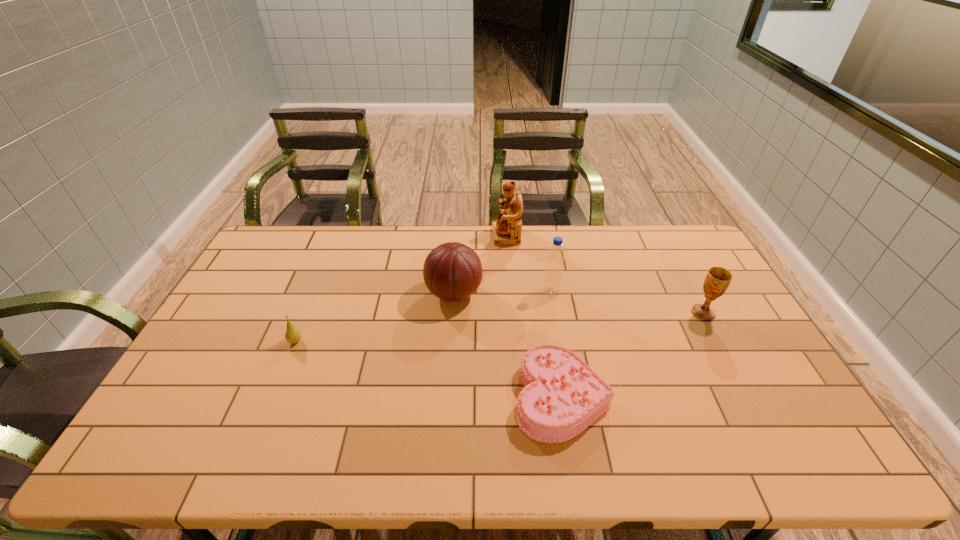
Locate an element on the screen. vacant space located 0.230m on the front-facing side of the figurine is located at coordinates (433, 236).

Image resolution: width=960 pixels, height=540 pixels. What are the coordinates of `free spot located on the front-facing side of the figurine` in the screenshot? It's located at (435, 236).

This screenshot has height=540, width=960. In order to click on vacant point located on the front of the water bottle in this screenshot , I will do `click(562, 354)`.

You are a GUI agent. You are given a task and a screenshot of the screen. Output one action in this format:
    pyautogui.click(x=<x>, y=<y>)
    Task: Click on the vacant space situated on the front of the basketball
    This screenshot has width=960, height=540.
    Given the screenshot: What is the action you would take?
    pyautogui.click(x=449, y=360)

Identify the location of vacant space located on the left of the rightmost object. (654, 313).

At what (x,y) coordinates should I click in order to perform the action: click on free space located 0.300m on the back of the pear. Please return your answer as a coordinate pair (x, y). Image resolution: width=960 pixels, height=540 pixels. Looking at the image, I should click on (324, 271).

Image resolution: width=960 pixels, height=540 pixels. I want to click on vacant space located 0.050m on the left of the shortest object, so click(x=495, y=396).

Image resolution: width=960 pixels, height=540 pixels. Identify the location of object situated at the far edge. (507, 230).

The width and height of the screenshot is (960, 540). I want to click on object that is at the near edge, so click(562, 395).

Where is `object located in the right edge section of the desktop`? The width and height of the screenshot is (960, 540). object located in the right edge section of the desktop is located at coordinates (718, 279).